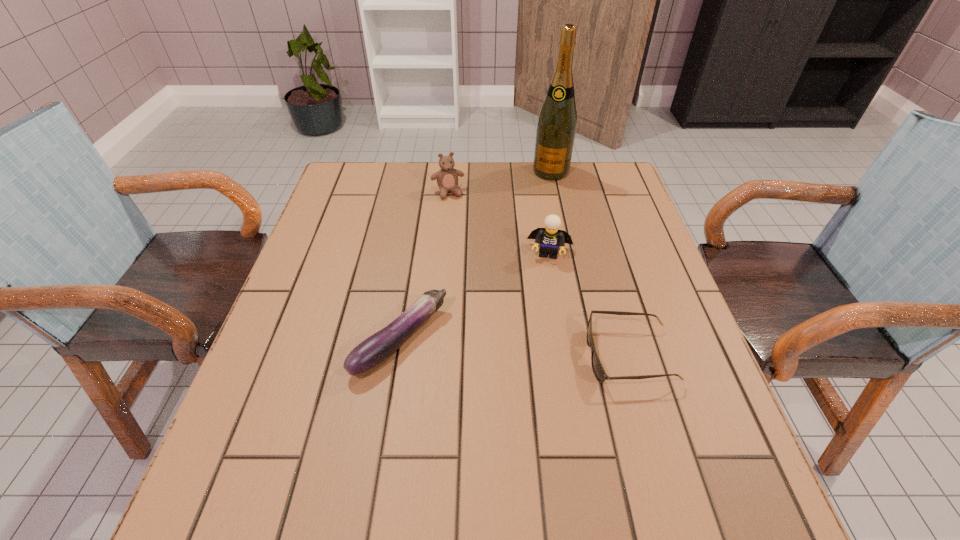
This screenshot has width=960, height=540. In order to click on wine bottle located at the far edge in this screenshot , I will do `click(556, 127)`.

Locate an element on the screen. object positioned at the right edge is located at coordinates (598, 370).

Identify the location of free spot at the far edge of the desktop. The width and height of the screenshot is (960, 540). (540, 192).

Find the location of `vacant space at the left edge of the desktop`. vacant space at the left edge of the desktop is located at coordinates (276, 320).

This screenshot has width=960, height=540. Identify the location of vacant space at the right edge of the desktop. (645, 327).

This screenshot has height=540, width=960. Find the location of `free spot at the far left corner of the desktop`. free spot at the far left corner of the desktop is located at coordinates (371, 206).

Identify the location of vacant area at the near left corner. Image resolution: width=960 pixels, height=540 pixels. (320, 416).

The width and height of the screenshot is (960, 540). In the image, there is a desktop. Find the location of `vacant space at the far right corner`. vacant space at the far right corner is located at coordinates (618, 202).

Locate an element on the screen. vacant area that lies between the fourth nearest object and the shortest object is located at coordinates (539, 274).

Image resolution: width=960 pixels, height=540 pixels. In order to click on vacant space in between the farthest object and the second shortest object in this screenshot , I will do `click(476, 256)`.